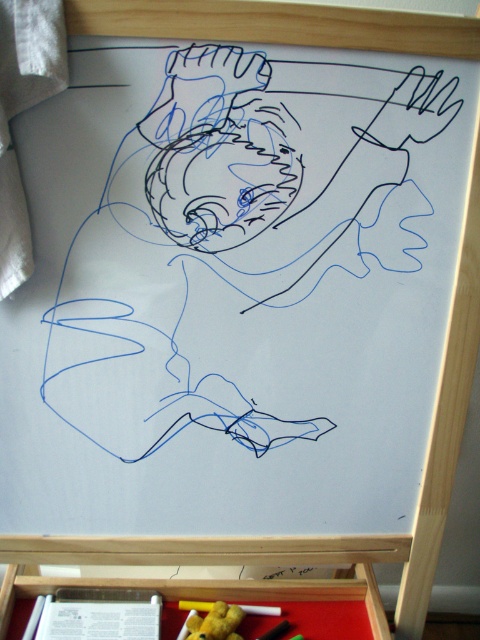
Consider the image. Which is more to the left, red matte drawer at lower center or yellow matte crayon at lower center?

Positioned to the left is red matte drawer at lower center.

Is red matte drawer at lower center taller than yellow matte crayon at lower center?

Indeed, red matte drawer at lower center has a greater height compared to yellow matte crayon at lower center.

Is point (358, 573) positioned after point (204, 605)?

Yes, it is.

At what (x,y) coordinates should I click in order to perform the action: click on red matte drawer at lower center. Please return your answer as a coordinate pair (x, y). The height and width of the screenshot is (640, 480). Looking at the image, I should click on (216, 592).